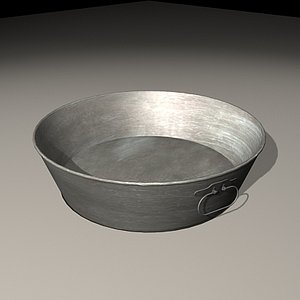
Identify the location of white table, blank space. pos(128,55).